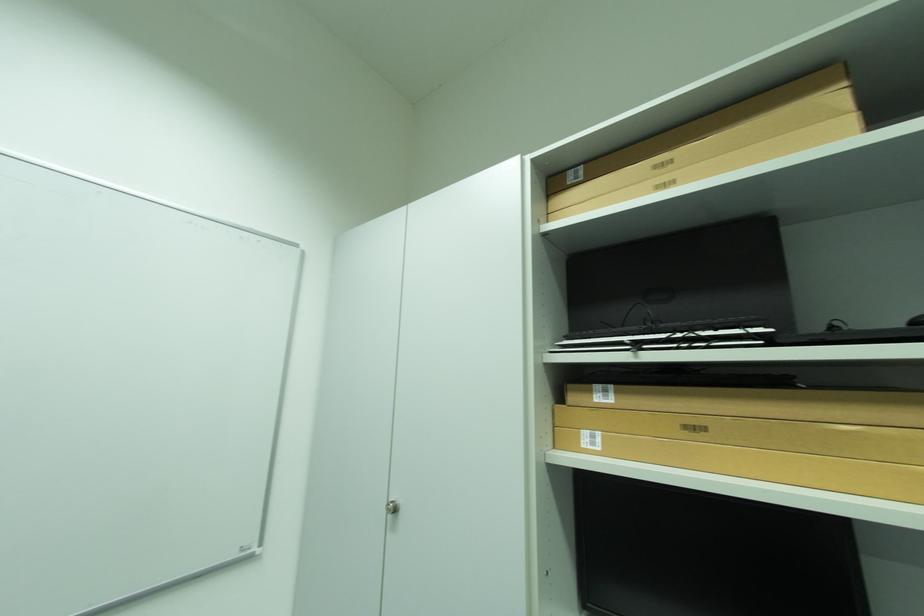
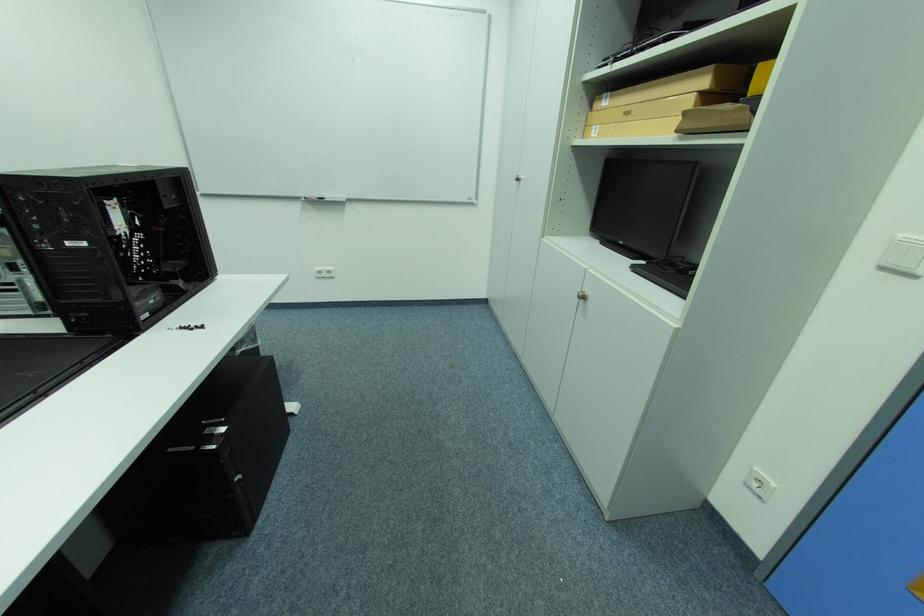
Locate, in the second image, the point that corresponds to (x=593, y=434) in the first image.

(602, 128)